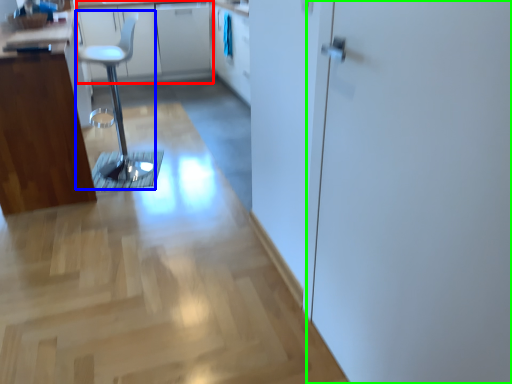
Question: Which is farther away from counter top (highlighted by a red box)? step stool (highlighted by a blue box) or screen door (highlighted by a green box)?

Choices:
 (A) step stool
 (B) screen door

Answer: (B)